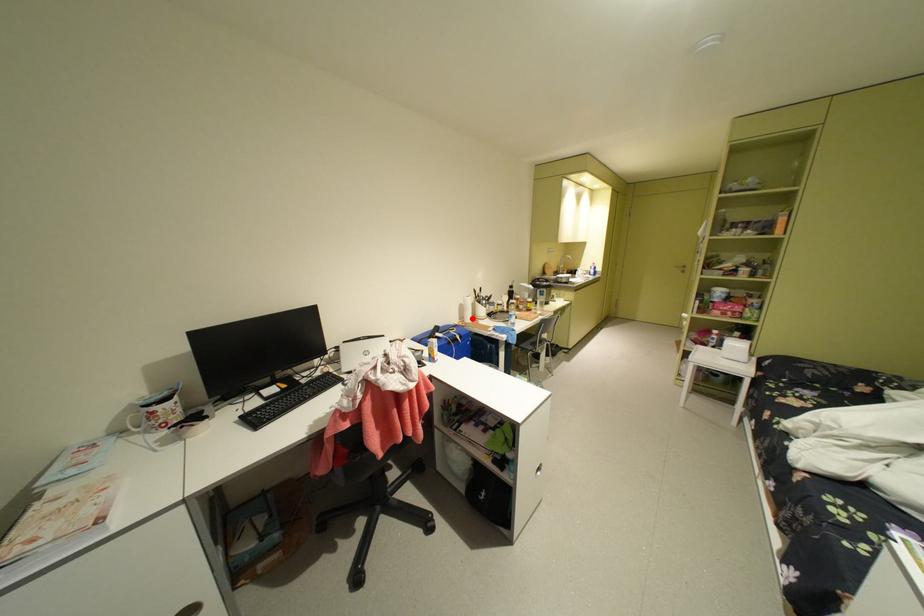
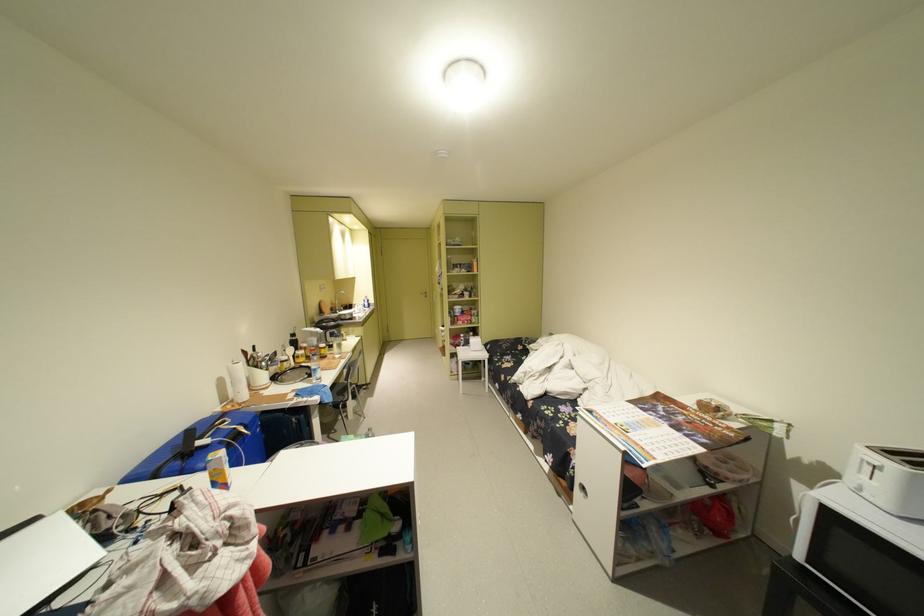
Locate, in the second image, the point that corresponds to the highlighted location in the first image.

(236, 399)